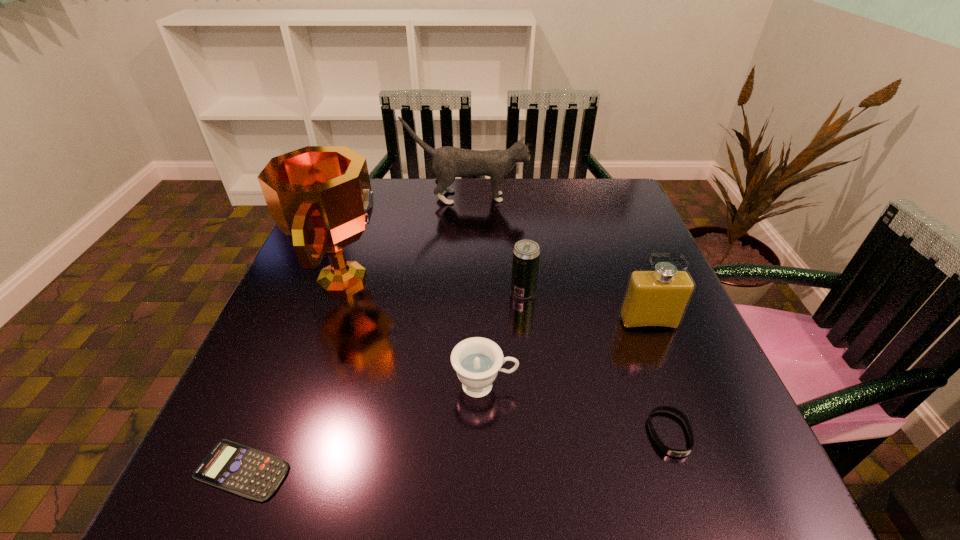
Find the location of a particular element. The height and width of the screenshot is (540, 960). award is located at coordinates (320, 196).

I want to click on cat, so click(448, 162).

Find the location of `the second tallest object`. the second tallest object is located at coordinates (448, 162).

Where is `the third tallest object`? The width and height of the screenshot is (960, 540). the third tallest object is located at coordinates (654, 299).

I want to click on the fourth tallest object, so click(x=526, y=253).

You are a GUI agent. You are given a task and a screenshot of the screen. Output one action in this format:
    pyautogui.click(x=<x>, y=<y>)
    Task: Click on the teacup
    The height and width of the screenshot is (540, 960).
    Given the screenshot: What is the action you would take?
    pyautogui.click(x=477, y=360)

This screenshot has width=960, height=540. What are the coordinates of `the third nearest object` in the screenshot? It's located at point(477,360).

At what (x,y) coordinates should I click in order to perform the action: click on the second shortest object. Please return your answer as a coordinate pair (x, y). Looking at the image, I should click on (665, 449).

Identify the location of the shortest object. This screenshot has width=960, height=540. (247, 472).

Where is `free space located 0.190m on the side of the award with the star emblem`? Image resolution: width=960 pixels, height=540 pixels. free space located 0.190m on the side of the award with the star emblem is located at coordinates (470, 279).